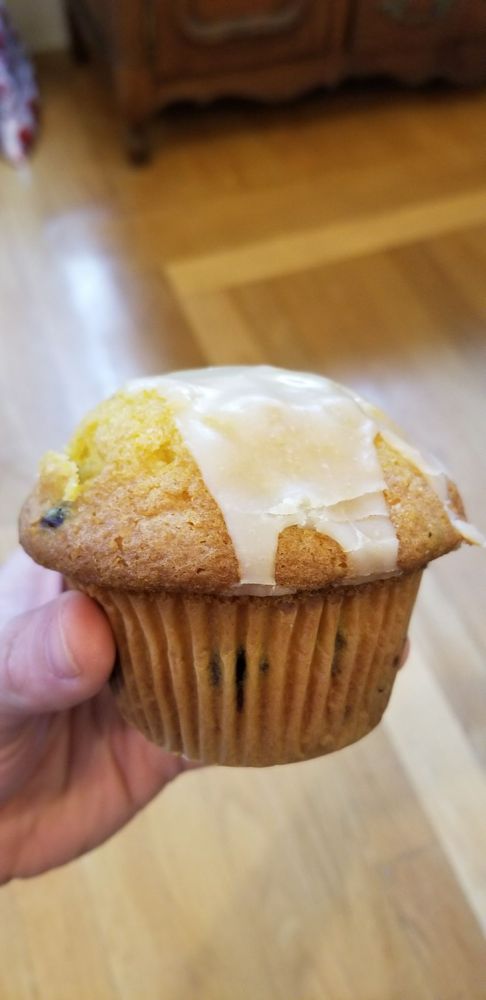
You are a GUI agent. You are given a task and a screenshot of the screen. Output one action in this format:
    pyautogui.click(x=<x>, y=<y>)
    Task: Click on the wooden floor
    This screenshot has width=486, height=1000.
    Given the screenshot: What is the action you would take?
    pyautogui.click(x=315, y=887)